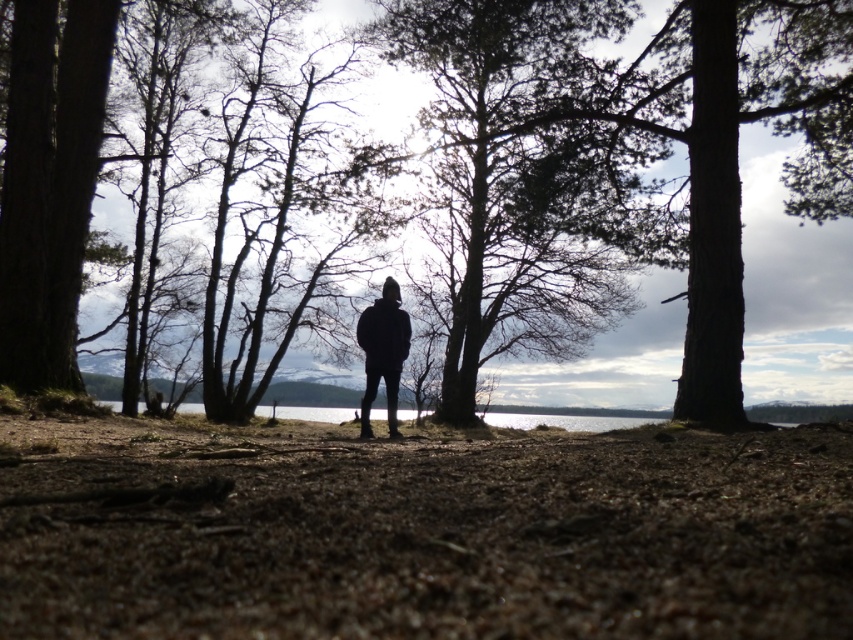
You are standing in the natural environment described. You see a brown textured tree at center and a dark green textured tree at center. Which tree is closer to the ground?

The brown textured tree at center is closer to the ground because it is positioned below the dark green textured tree at center.

You are planning to take a photo of the brown textured tree at center and the black matte jacket at center in the scene. Which object should you zoom in on to ensure both are fully visible in the frame?

The brown textured tree at center is wider than the black matte jacket at center, so you should zoom in on the tree to ensure both are fully visible in the frame.